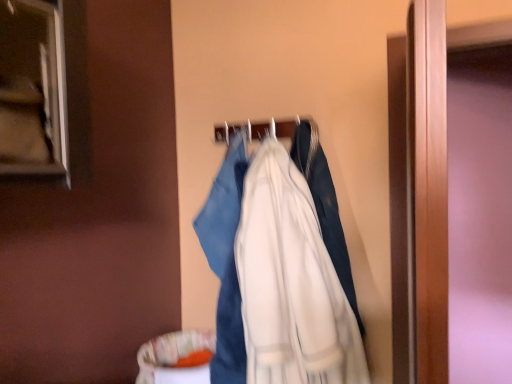
Question: Based on their sizes in the image, would you say white cotton coat at center is bigger or smaller than white fabric hanger at center?

Choices:
 (A) small
 (B) big

Answer: (B)

Question: Considering the positions of white cotton coat at center and white fabric hanger at center in the image, is white cotton coat at center taller or shorter than white fabric hanger at center?

Choices:
 (A) short
 (B) tall

Answer: (B)

Question: From a real-world perspective, is white cotton coat at center above or below white fabric hanger at center?

Choices:
 (A) above
 (B) below

Answer: (B)

Question: In the image, is white fabric hanger at center on the left side or the right side of white cotton coat at center?

Choices:
 (A) right
 (B) left

Answer: (B)

Question: Would you say white fabric hanger at center is inside or outside white cotton coat at center?

Choices:
 (A) outside
 (B) inside

Answer: (A)

Question: Looking at the image, does white fabric hanger at center seem bigger or smaller compared to white cotton coat at center?

Choices:
 (A) small
 (B) big

Answer: (A)

Question: Is point click(x=223, y=134) closer or farther from the camera than point click(x=314, y=244)?

Choices:
 (A) farther
 (B) closer

Answer: (A)